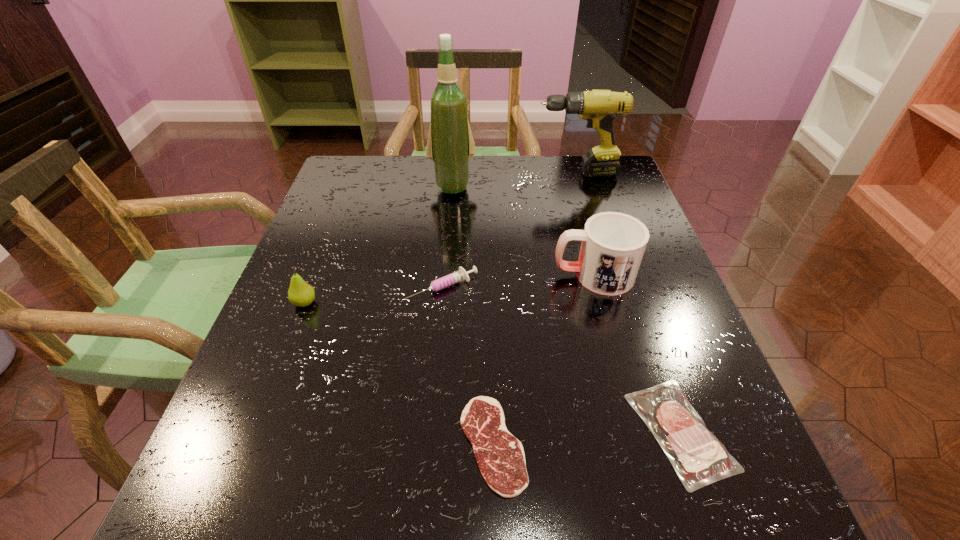
Identify the location of free space that satisfies the following two spatial constraints: 1. on the side of the right steak with the handle; 2. on the right side of the third tallest object. (636, 431).